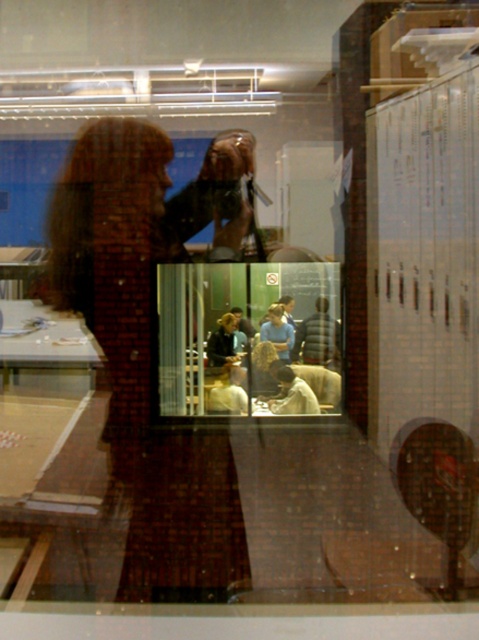
Which is behind, point (332, 340) or point (334, 330)?

The point (332, 340) is more distant.

Is transparent glass door at center further to the viewer compared to dark gray jacket at center?

No, transparent glass door at center is closer to the viewer.

In order to click on transparent glass door at center in this screenshot , I will do `click(248, 339)`.